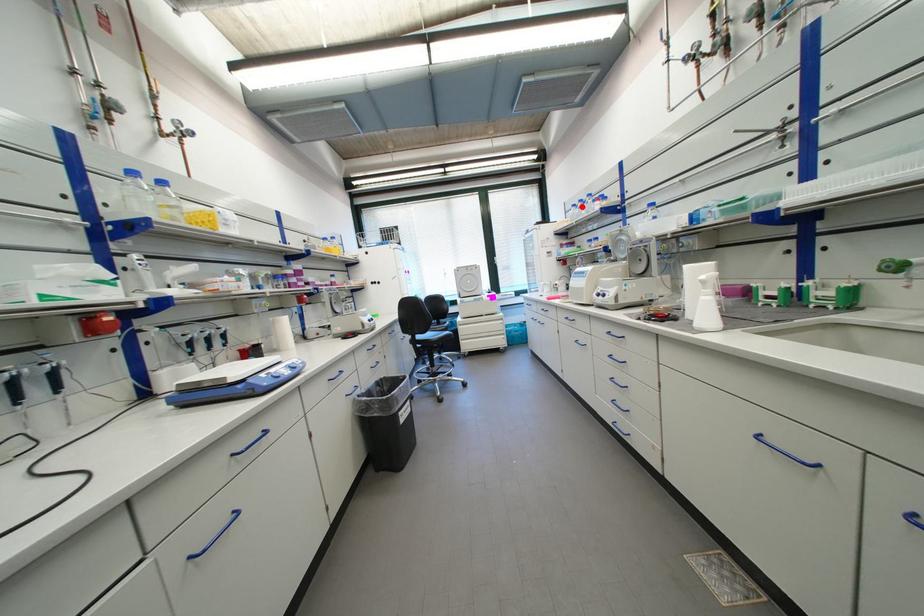
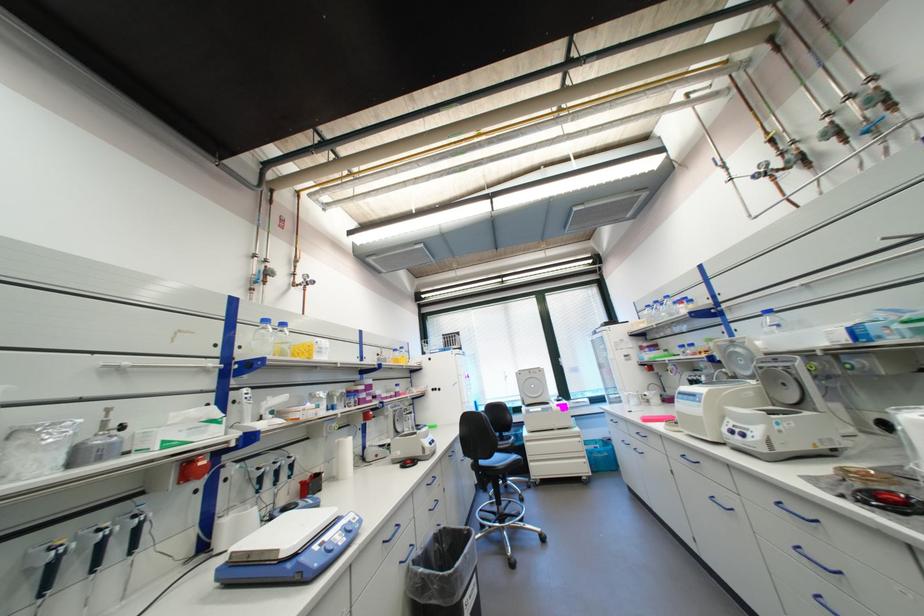
Where in the second image is the point corresponding to the highlighted location from the first image?

(655, 307)